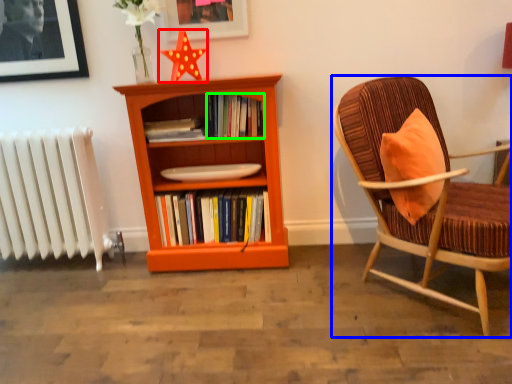
Question: Estimate the real-world distances between objects in this image. Which object is farther from star (highlighted by a red box), chair (highlighted by a blue box) or book (highlighted by a green box)?

Choices:
 (A) chair
 (B) book

Answer: (A)